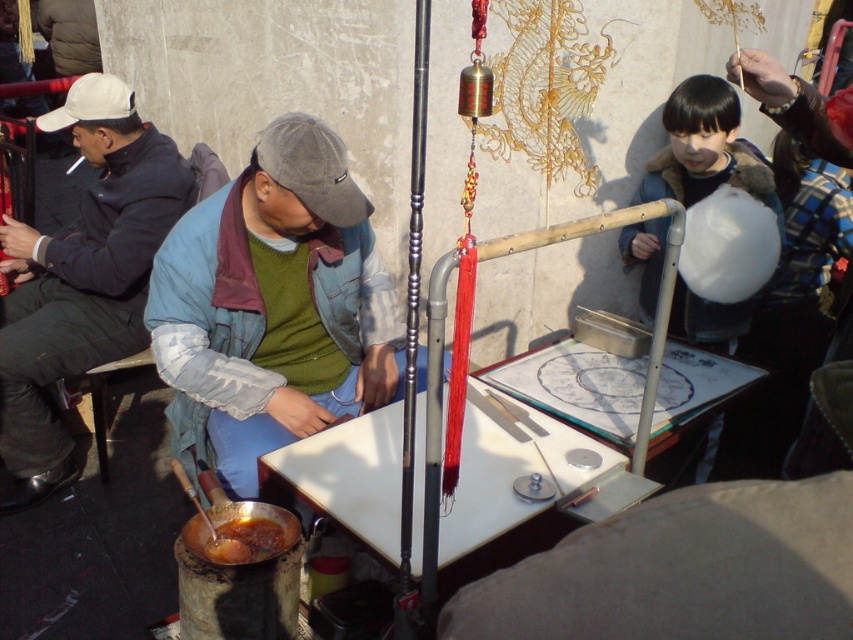
You are a customer at the cotton candy stall. You see the white cotton candy at right and the shiny brown sauce at lower left. Which item is closer to you?

The white cotton candy at right is closer to you because it is further to the viewer than the shiny brown sauce at lower left.

You are standing in the street scene and want to take a photo of the cotton candy maker. The camera you have can only focus on objects within 5 feet. Is the point at coordinates point (198, 282) within the focus range?

The point at coordinates point (198, 282) is 7.54 feet away from the camera, which is beyond the 5 feet focus range. Therefore, the camera cannot focus on it.

You are a customer at the cotton candy stall. You want to know which item is wider between the white cotton candy at right and the shiny brown sauce at lower left. Can you tell me?

The white cotton candy at right is wider than the shiny brown sauce at lower left.